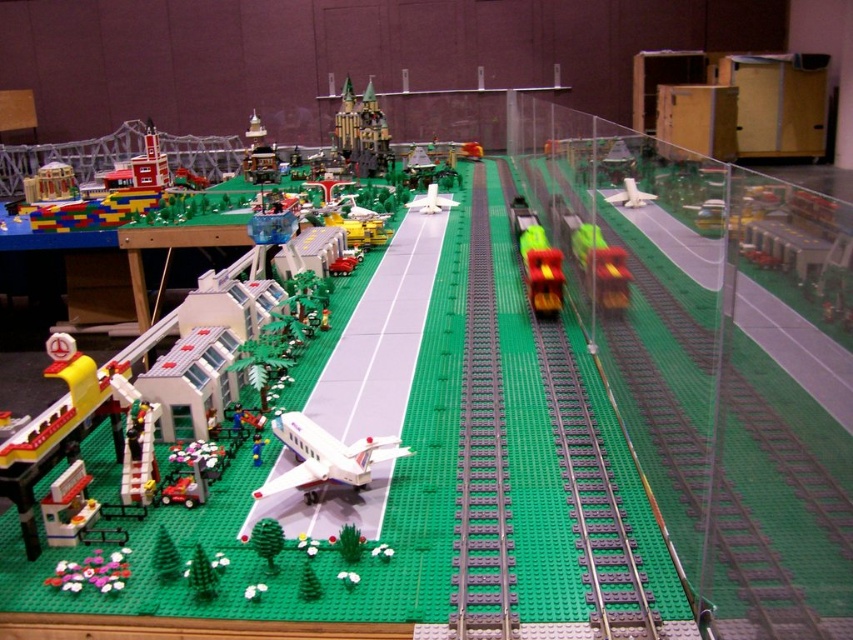
Is green plastic train track at center above shiny yellow train at center?

Incorrect, green plastic train track at center is not positioned above shiny yellow train at center.

Who is more forward, (488, 502) or (549, 284)?

Positioned in front is point (488, 502).

Which is in front, point (480, 273) or point (512, 204)?

Point (480, 273) is in front.

At what (x,y) coordinates should I click in order to perform the action: click on green plastic train track at center. Please return your answer as a coordinate pair (x, y). Looking at the image, I should click on (480, 452).

Is point (520, 211) more distant than point (413, 208)?

That is False.

Does point (563, 282) lie in front of point (419, 202)?

That is True.

Find the location of a particular element. The width and height of the screenshot is (853, 640). shiny yellow train at center is located at coordinates (537, 260).

Does white plastic airplane at center have a lesser height compared to white matte airplane at upper right?

No, white plastic airplane at center is not shorter than white matte airplane at upper right.

Who is positioned more to the left, white plastic airplane at center or white matte airplane at upper right?

Positioned to the left is white plastic airplane at center.

Is point (351, 472) in front of point (624, 195)?

Yes, it is in front of point (624, 195).

Locate an element on the screen. This screenshot has width=853, height=640. white plastic airplane at center is located at coordinates (325, 456).